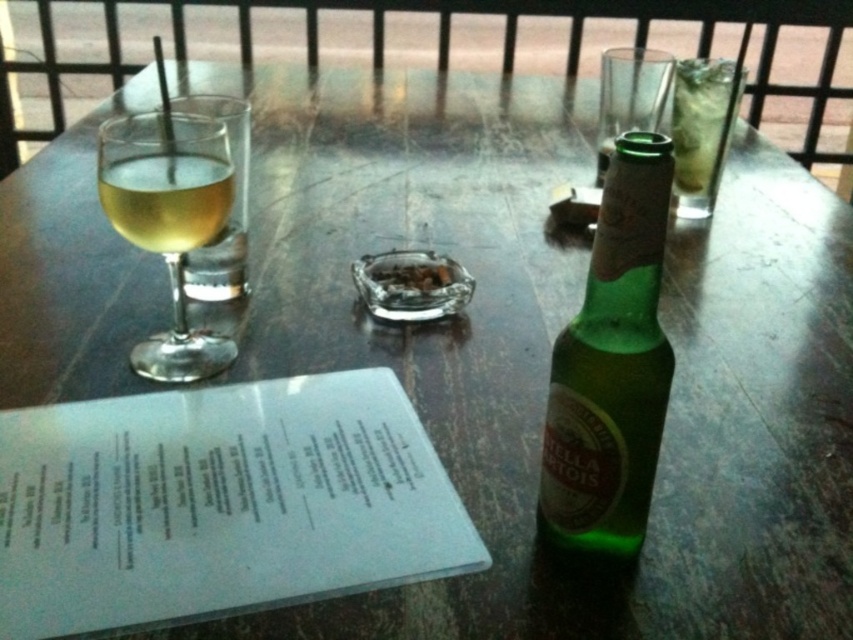
Is green glass bottle at center-right smaller than transparent glass at left?

Correct, green glass bottle at center-right occupies less space than transparent glass at left.

Can you confirm if green glass bottle at center-right is shorter than transparent glass at left?

No, green glass bottle at center-right is not shorter than transparent glass at left.

The height and width of the screenshot is (640, 853). What do you see at coordinates (611, 365) in the screenshot? I see `green glass bottle at center-right` at bounding box center [611, 365].

Identify the location of green glass bottle at center-right. The width and height of the screenshot is (853, 640). point(611,365).

Which of these two, white paper menu at lower left or transparent glass at left, stands taller?

transparent glass at left

Does white paper menu at lower left have a smaller size compared to transparent glass at left?

Incorrect, white paper menu at lower left is not smaller in size than transparent glass at left.

Which is in front, point (15, 472) or point (206, 221)?

Positioned in front is point (15, 472).

Locate an element on the screen. This screenshot has height=640, width=853. white paper menu at lower left is located at coordinates (218, 504).

Measure the distance from white paper menu at lower left to translucent glass at left.

16.37 centimeters

Which is behind, point (106, 593) or point (102, 173)?

The point (102, 173) is behind.

Between point (241, 394) and point (161, 230), which one is positioned behind?

Point (241, 394)

Image resolution: width=853 pixels, height=640 pixels. What are the coordinates of `white paper menu at lower left` in the screenshot? It's located at (218, 504).